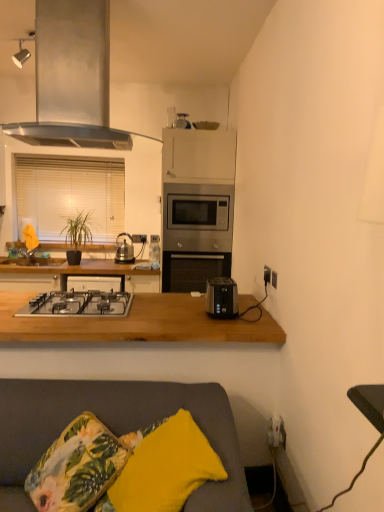
Question: Can you confirm if black plastic socket at right, placed as the 2th electric outlet when sorted from top to bottom, is thinner than yellow fabric pillow at lower center?

Choices:
 (A) yes
 (B) no

Answer: (A)

Question: Does black plastic socket at right, placed as the 2th electric outlet when sorted from top to bottom, have a greater height compared to yellow fabric pillow at lower center?

Choices:
 (A) yes
 (B) no

Answer: (B)

Question: Is black plastic socket at right, the 1th electric outlet when ordered from front to back, oriented away from yellow fabric pillow at lower center?

Choices:
 (A) yes
 (B) no

Answer: (B)

Question: Are black plastic socket at right, which ranks as the 2th electric outlet in left-to-right order, and yellow fabric pillow at lower center making contact?

Choices:
 (A) yes
 (B) no

Answer: (B)

Question: Is black plastic socket at right, marked as the first electric outlet in a bottom-to-top arrangement, located outside yellow fabric pillow at lower center?

Choices:
 (A) yes
 (B) no

Answer: (A)

Question: From the image's perspective, is black plastic socket at right, which ranks as the 1th electric outlet in right-to-left order, located beneath yellow fabric pillow at lower center?

Choices:
 (A) no
 (B) yes

Answer: (A)

Question: From a real-world perspective, is stainless steel gas stove at center on top of stainless steel microwave at center?

Choices:
 (A) no
 (B) yes

Answer: (A)

Question: Does stainless steel gas stove at center contain stainless steel microwave at center?

Choices:
 (A) no
 (B) yes

Answer: (A)

Question: Considering the relative positions of stainless steel gas stove at center and stainless steel microwave at center in the image provided, is stainless steel gas stove at center behind stainless steel microwave at center?

Choices:
 (A) yes
 (B) no

Answer: (B)

Question: Considering the relative sizes of stainless steel gas stove at center and stainless steel microwave at center in the image provided, is stainless steel gas stove at center taller than stainless steel microwave at center?

Choices:
 (A) yes
 (B) no

Answer: (B)

Question: Can you confirm if stainless steel gas stove at center is bigger than stainless steel microwave at center?

Choices:
 (A) yes
 (B) no

Answer: (B)

Question: Is stainless steel gas stove at center not close to stainless steel microwave at center?

Choices:
 (A) no
 (B) yes

Answer: (B)

Question: Is white blinds at left next to black plastic socket at right, the 1th electric outlet when ordered from front to back?

Choices:
 (A) yes
 (B) no

Answer: (B)